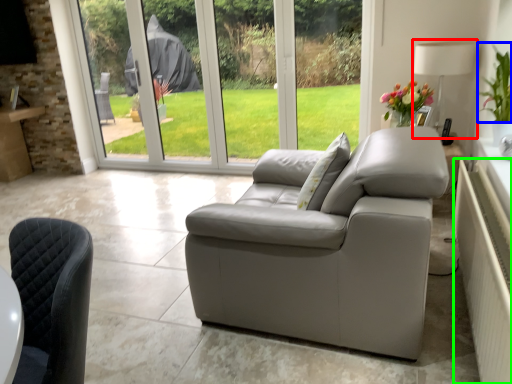
Question: Which object is the closest to the lamp (highlighted by a red box)? Choose among these: plant (highlighted by a blue box) or radiator (highlighted by a green box).

Choices:
 (A) plant
 (B) radiator

Answer: (A)